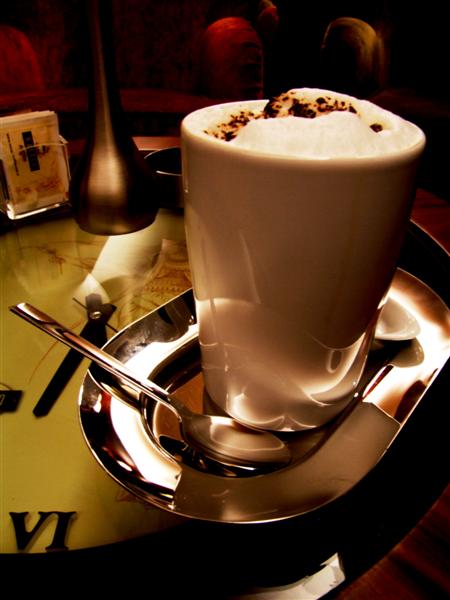
The image size is (450, 600). I want to click on clock, so click(113, 561).